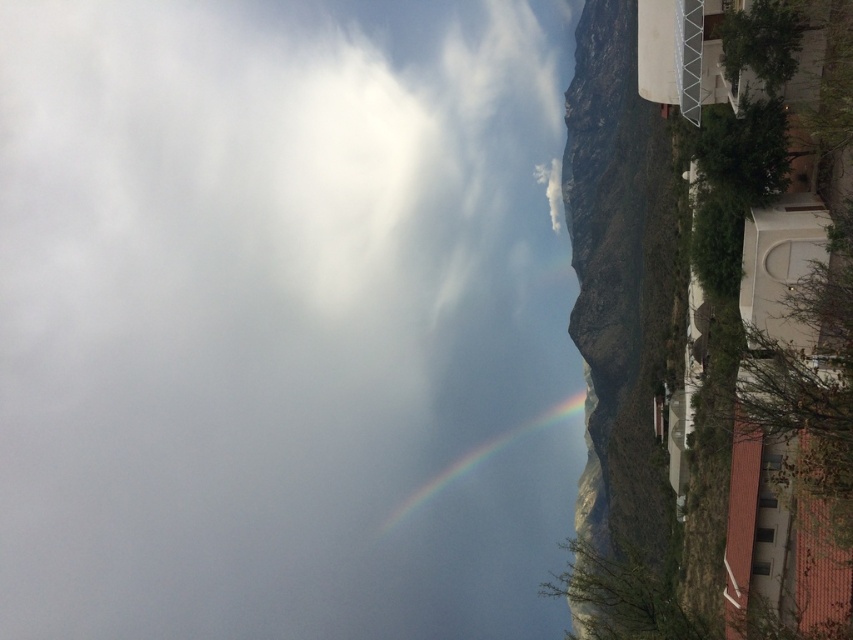
Question: From the image, what is the correct spatial relationship of rugged stone mountain at right in relation to rainbow at center?

Choices:
 (A) right
 (B) left

Answer: (A)

Question: Among these points, which one is nearest to the camera?

Choices:
 (A) (477, 608)
 (B) (437, 477)
 (C) (589, 381)

Answer: (C)

Question: Can you confirm if rugged stone mountain at right is positioned above rainbow at center?

Choices:
 (A) no
 (B) yes

Answer: (B)

Question: Among these objects, which one is farthest from the camera?

Choices:
 (A) rugged stone mountain at right
 (B) rainbow at center

Answer: (B)

Question: Which point is closer to the camera?

Choices:
 (A) (488, 237)
 (B) (581, 397)

Answer: (B)

Question: From the image, what is the correct spatial relationship of white fluffy cloud at upper left in relation to rugged stone mountain at right?

Choices:
 (A) below
 (B) above

Answer: (B)